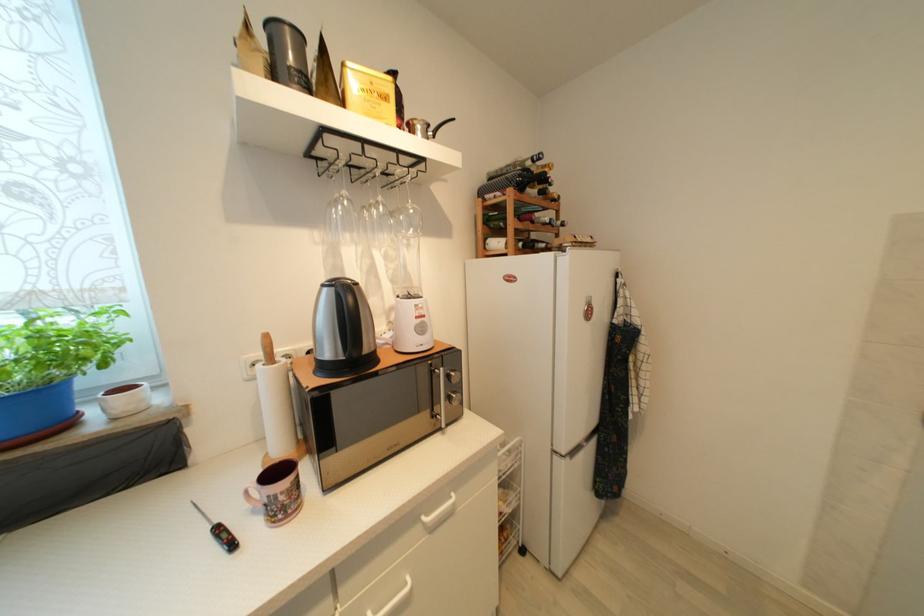
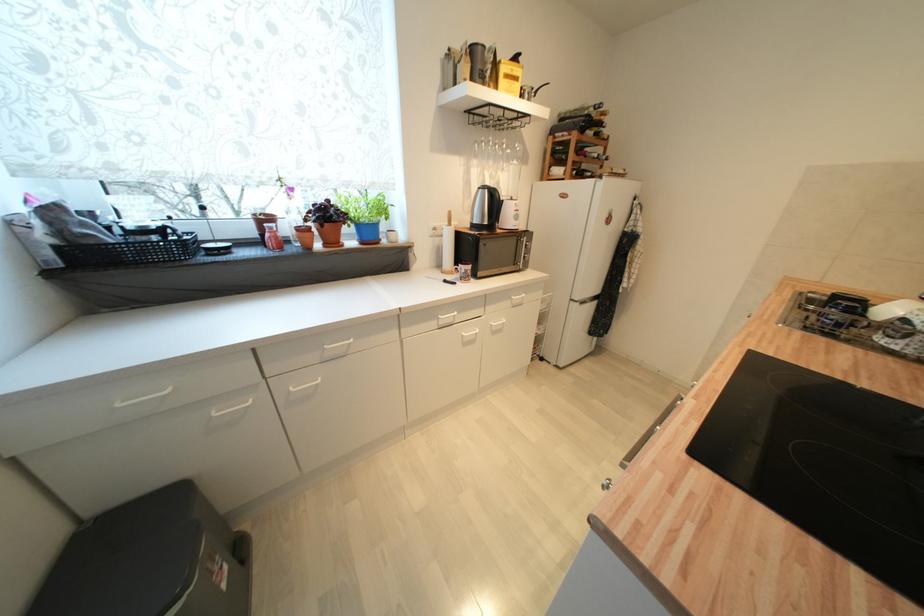
Find the pixel in the second image that matches pixel 264 368 in the first image.

(450, 229)